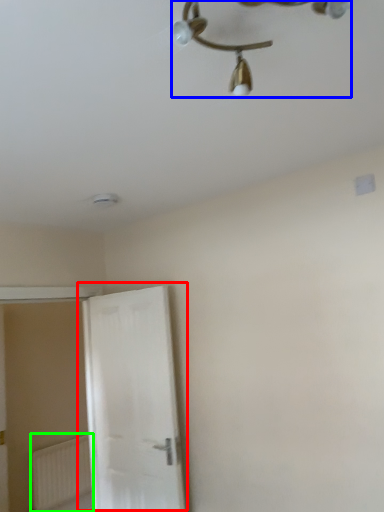
Question: Which is nearer to the door (highlighted by a red box)? lamp (highlighted by a blue box) or radiator (highlighted by a green box).

Choices:
 (A) lamp
 (B) radiator

Answer: (B)